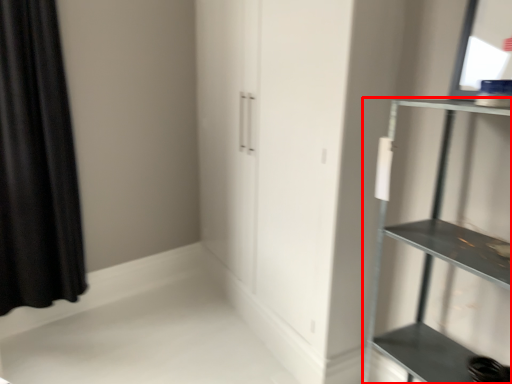
Question: Where is shelf (annotated by the red box) located in relation to curtain in the image?

Choices:
 (A) left
 (B) right

Answer: (B)